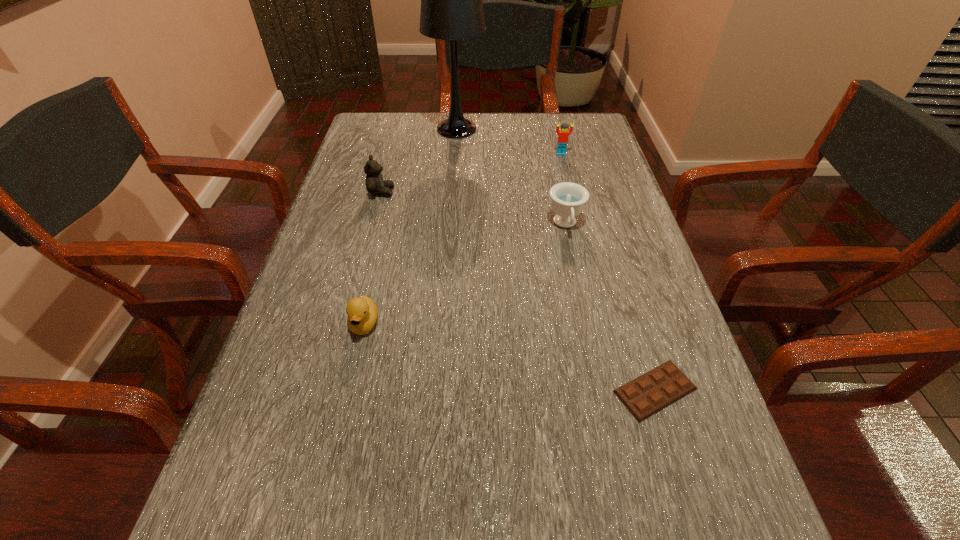
The image size is (960, 540). Find the location of `vacant area between the third farthest object and the Lego`. vacant area between the third farthest object and the Lego is located at coordinates (471, 173).

Locate an element on the screen. This screenshot has height=540, width=960. unoccupied position between the teacup and the duckling is located at coordinates (465, 274).

Identify the location of vacant point located between the nearest object and the fourth object from right to left. (556, 259).

What are the coordinates of `free space between the teddy bear and the Lego` in the screenshot? It's located at (471, 173).

Choose which object is the fourth nearest neighbor to the shortest object. Please provide its 2D coordinates. Your answer should be formatted as a tuple, i.e. [(x, y)], where the tuple contains the x and y coordinates of a point satisfying the conditions above.

[(563, 134)]

You are a GUI agent. You are given a task and a screenshot of the screen. Output one action in this format:
    pyautogui.click(x=<x>, y=<y>)
    Task: Click on the object that is the closest to the Lego
    The width and height of the screenshot is (960, 540).
    Given the screenshot: What is the action you would take?
    pyautogui.click(x=451, y=0)

The height and width of the screenshot is (540, 960). In order to click on free space in the image that satisfies the following two spatial constraints: 1. on the face of the shortest object; 2. on the left side of the fourth nearest object in this screenshot , I will do `click(329, 390)`.

You are a GUI agent. You are given a task and a screenshot of the screen. Output one action in this format:
    pyautogui.click(x=<x>, y=<y>)
    Task: Click on the vacant space that satisfies the following two spatial constraints: 1. on the face of the Lego; 2. on the left side of the nearest object
    The image size is (960, 540).
    Given the screenshot: What is the action you would take?
    pyautogui.click(x=618, y=390)

You are a GUI agent. You are given a task and a screenshot of the screen. Output one action in this format:
    pyautogui.click(x=<x>, y=<y>)
    Task: Click on the free space that satisfies the following two spatial constraints: 1. on the face of the second farthest object; 2. on the face of the teddy bear
    The width and height of the screenshot is (960, 540).
    Given the screenshot: What is the action you would take?
    pyautogui.click(x=570, y=192)

Locate an element on the screen. Image resolution: width=960 pixels, height=540 pixels. free spot that satisfies the following two spatial constraints: 1. on the front side of the chocolate bar; 2. on the left side of the farthest object is located at coordinates (437, 390).